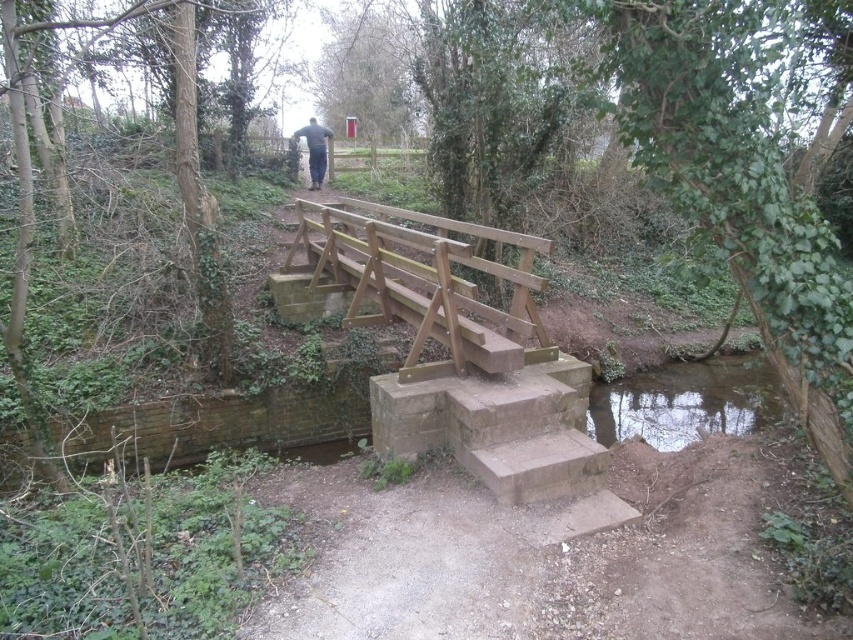
Is natural wood bridge at center behind dark blue jeans at center?

No, natural wood bridge at center is closer to the viewer.

Between natural wood bridge at center and dark blue jeans at center, which one has less height?

natural wood bridge at center

You are a GUI agent. You are given a task and a screenshot of the screen. Output one action in this format:
    pyautogui.click(x=<x>, y=<y>)
    Task: Click on the natural wood bridge at center
    Image resolution: width=853 pixels, height=640 pixels.
    Given the screenshot: What is the action you would take?
    pyautogui.click(x=422, y=284)

Who is more distant from viewer, [616,436] or [318,164]?

Point [318,164]

Is clear glassy water at lower right further to the viewer compared to dark blue jeans at center?

That is False.

The image size is (853, 640). Describe the element at coordinates (688, 401) in the screenshot. I see `clear glassy water at lower right` at that location.

This screenshot has height=640, width=853. Find the location of `clear glassy water at lower right`. clear glassy water at lower right is located at coordinates (688, 401).

Is point (306, 227) behind point (769, 397)?

No.

Is natural wood bridge at center bigger than clear glassy water at lower right?

Incorrect, natural wood bridge at center is not larger than clear glassy water at lower right.

Who is more forward, [515,298] or [743,429]?

Point [515,298] is in front.

Image resolution: width=853 pixels, height=640 pixels. Find the location of `natural wood bridge at center`. natural wood bridge at center is located at coordinates (422, 284).